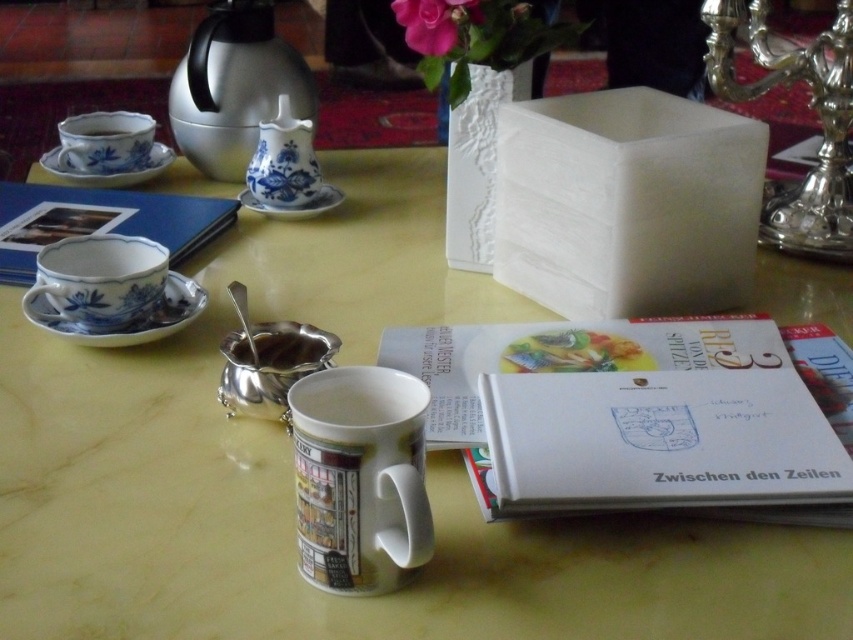
Question: Considering the real-world distances, which object is farthest from the white glossy mug at center?

Choices:
 (A) blue and white ceramic book at upper left
 (B) silver metallic sugar bowl at center
 (C) blue porcelain teacup at upper left
 (D) blue porcelain saucer at center

Answer: (C)

Question: Does blue porcelain teacup at left appear on the right side of blue porcelain cup at left?

Choices:
 (A) yes
 (B) no

Answer: (A)

Question: Does white glossy mug at center appear on the left side of blue porcelain cup at left?

Choices:
 (A) yes
 (B) no

Answer: (B)

Question: Among these points, which one is farthest from the camera?

Choices:
 (A) (267, 212)
 (B) (135, 177)
 (C) (305, 333)
 (D) (96, 131)

Answer: (D)

Question: Does white paper book at center have a lesser width compared to shiny metallic tea pot at upper left?

Choices:
 (A) no
 (B) yes

Answer: (A)

Question: Which point appears closest to the camera in this image?

Choices:
 (A) (486, 355)
 (B) (50, 212)

Answer: (A)